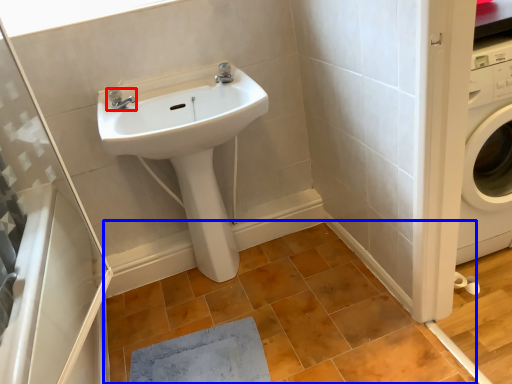
Question: Which object appears farthest to the camera in this image, tap (highlighted by a red box) or tile (highlighted by a blue box)?

Choices:
 (A) tap
 (B) tile

Answer: (A)